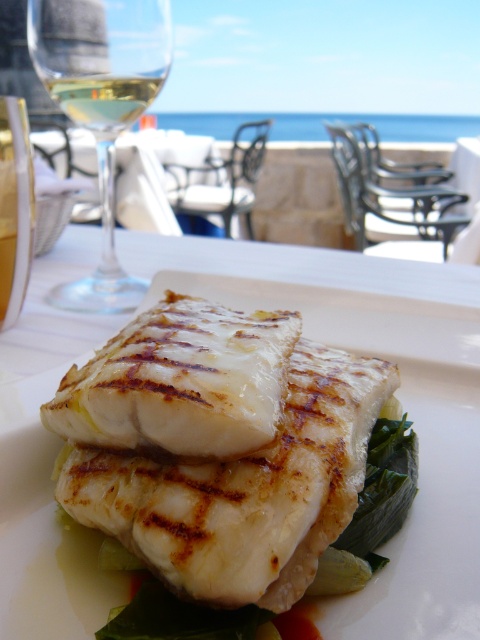
Question: Which object is positioned closest to the gold metallic wine glass at left?

Choices:
 (A) clear glass wine glass at upper left
 (B) white glossy plate at center

Answer: (A)

Question: Is white glossy plate at center positioned in front of clear glass wine at upper left?

Choices:
 (A) yes
 (B) no

Answer: (A)

Question: Which is farther from the gold metallic wine glass at left?

Choices:
 (A) clear glass wine glass at upper left
 (B) white glossy plate at center
 (C) clear glass wine at upper left

Answer: (B)

Question: Does white glossy plate at center appear under gold metallic wine glass at left?

Choices:
 (A) no
 (B) yes

Answer: (B)

Question: Among these objects, which one is nearest to the camera?

Choices:
 (A) white glossy plate at center
 (B) clear glass wine at upper left

Answer: (A)

Question: Does clear glass wine glass at upper left have a greater width compared to gold metallic wine glass at left?

Choices:
 (A) yes
 (B) no

Answer: (A)